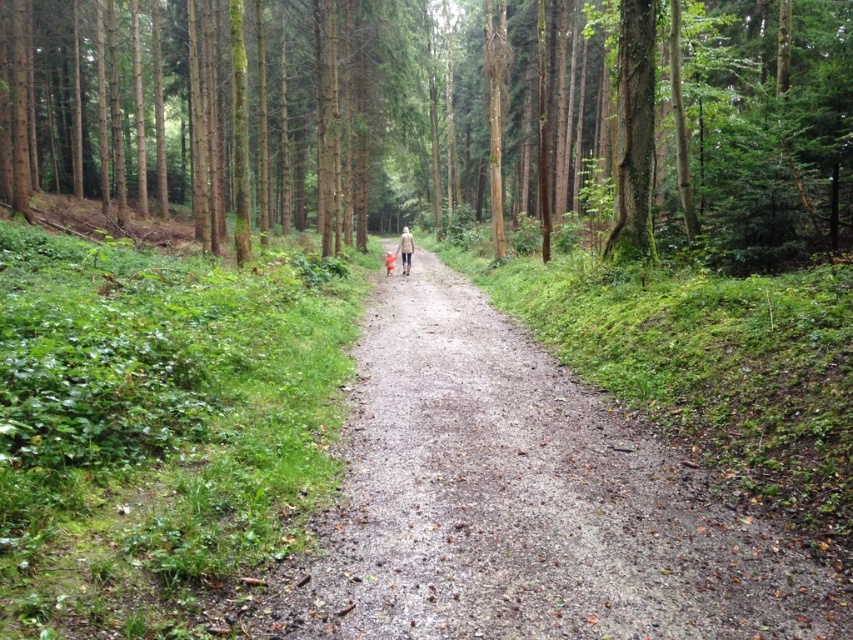
You are a hiker standing at the starting point of the narrow dirt path in the forest. You notice a green mossy tree at center. Can you determine its exact location in terms of coordinates?

The green mossy tree at center is located at coordinates point (448,116).

You are a hiker walking along the narrow dirt path in the forest. You notice two points marked on the path. The first point is at coordinates point [763,28], and the second point is at point [401,262]. As you walk forward, which point will you encounter first?

Point [763,28] is in front of point [401,262], so you will encounter point [763,28] first as you walk forward along the path.

You are a hiker who has lost your way in the forest. You spot two items on the narrow dirt path at the center of the scene. The items are the light brown leather jacket at center and the orange fabric child at center. Which item is positioned higher up on the path?

The light brown leather jacket at center is above the orange fabric child at center, so it is positioned higher up on the path.